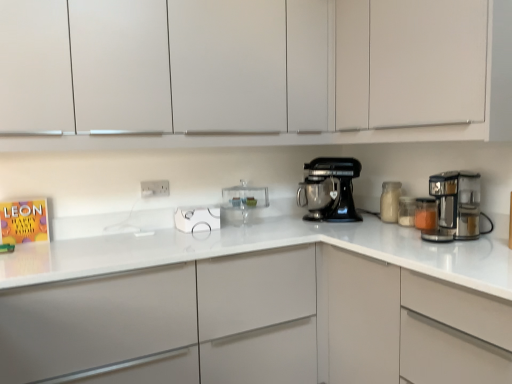
Question: Can you confirm if translucent glass jar at right, placed as the 3th kitchen appliance when sorted from left to right, is shorter than white glass jar at right, which ranks as the third kitchen appliance in right-to-left order?

Choices:
 (A) yes
 (B) no

Answer: (A)

Question: Does translucent glass jar at right, placed as the 3th kitchen appliance when sorted from left to right, touch white glass jar at right, which ranks as the third kitchen appliance in right-to-left order?

Choices:
 (A) yes
 (B) no

Answer: (A)

Question: Considering the relative sizes of translucent glass jar at right, which ranks as the second kitchen appliance in right-to-left order, and white glass jar at right, which ranks as the third kitchen appliance in right-to-left order, in the image provided, is translucent glass jar at right, which ranks as the second kitchen appliance in right-to-left order, thinner than white glass jar at right, which ranks as the third kitchen appliance in right-to-left order,?

Choices:
 (A) no
 (B) yes

Answer: (B)

Question: Can you confirm if translucent glass jar at right, which ranks as the second kitchen appliance in right-to-left order, is wider than white glass jar at right, which ranks as the third kitchen appliance in right-to-left order?

Choices:
 (A) no
 (B) yes

Answer: (A)

Question: Does translucent glass jar at right, which ranks as the second kitchen appliance in right-to-left order, appear on the left side of white glass jar at right, marked as the 2th kitchen appliance in a left-to-right arrangement?

Choices:
 (A) yes
 (B) no

Answer: (B)

Question: Is white glass jar at right, which ranks as the third kitchen appliance in right-to-left order, taller or shorter than translucent glass jar at right, placed as the 3th kitchen appliance when sorted from left to right?

Choices:
 (A) short
 (B) tall

Answer: (B)

Question: From a real-world perspective, is white glass jar at right, marked as the 2th kitchen appliance in a left-to-right arrangement, positioned above or below translucent glass jar at right, placed as the 3th kitchen appliance when sorted from left to right?

Choices:
 (A) above
 (B) below

Answer: (A)

Question: Looking at their shapes, would you say white glass jar at right, marked as the 2th kitchen appliance in a left-to-right arrangement, is wider or thinner than translucent glass jar at right, placed as the 3th kitchen appliance when sorted from left to right?

Choices:
 (A) wide
 (B) thin

Answer: (A)

Question: From the image's perspective, is white glass jar at right, marked as the 2th kitchen appliance in a left-to-right arrangement, positioned above or below translucent glass jar at right, which ranks as the second kitchen appliance in right-to-left order?

Choices:
 (A) below
 (B) above

Answer: (B)

Question: Based on their sizes in the image, would you say black metallic stand mixer at center is bigger or smaller than translucent glass jar at right, arranged as the 4th kitchen appliance when viewed from the left?

Choices:
 (A) small
 (B) big

Answer: (B)

Question: In terms of height, does black metallic stand mixer at center look taller or shorter compared to translucent glass jar at right, positioned as the first kitchen appliance in right-to-left order?

Choices:
 (A) tall
 (B) short

Answer: (A)

Question: Visually, is black metallic stand mixer at center positioned to the left or to the right of translucent glass jar at right, positioned as the first kitchen appliance in right-to-left order?

Choices:
 (A) right
 (B) left

Answer: (B)

Question: Is black metallic stand mixer at center wider or thinner than translucent glass jar at right, positioned as the first kitchen appliance in right-to-left order?

Choices:
 (A) wide
 (B) thin

Answer: (A)

Question: Is white glass jar at right, which ranks as the third kitchen appliance in right-to-left order, in front of or behind white matte cabinet at upper center, positioned as the second cabinetry in top-to-bottom order, in the image?

Choices:
 (A) front
 (B) behind

Answer: (B)

Question: From a real-world perspective, is white glass jar at right, marked as the 2th kitchen appliance in a left-to-right arrangement, physically located above or below white matte cabinet at upper center, marked as the 2th cabinetry in a bottom-to-top arrangement?

Choices:
 (A) below
 (B) above

Answer: (A)